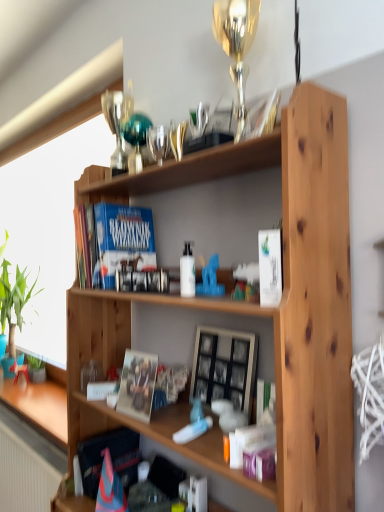
Question: Considering the relative positions of green leafy plant at left, which is the 2th houseplant in front-to-back order, and white glossy bottle at center in the image provided, is green leafy plant at left, which is the 2th houseplant in front-to-back order, to the left of white glossy bottle at center from the viewer's perspective?

Choices:
 (A) no
 (B) yes

Answer: (B)

Question: Is green leafy plant at left, which is the first houseplant in top-to-bottom order, taller than white glossy bottle at center?

Choices:
 (A) no
 (B) yes

Answer: (B)

Question: Is green leafy plant at left, arranged as the 1th houseplant when viewed from the back, facing away from white glossy bottle at center?

Choices:
 (A) no
 (B) yes

Answer: (A)

Question: Is green leafy plant at left, which is the first houseplant in top-to-bottom order, touching white glossy bottle at center?

Choices:
 (A) no
 (B) yes

Answer: (A)

Question: Considering the relative sizes of green leafy plant at left, which appears as the second houseplant when ordered from the bottom, and white glossy bottle at center in the image provided, is green leafy plant at left, which appears as the second houseplant when ordered from the bottom, bigger than white glossy bottle at center?

Choices:
 (A) no
 (B) yes

Answer: (B)

Question: Is green leafy plant at left, which appears as the second houseplant when ordered from the bottom, in front of white glossy bottle at center?

Choices:
 (A) yes
 (B) no

Answer: (B)

Question: Is blue matte book at upper left, which is counted as the second paperback book, starting from the front, positioned beyond the bounds of green leafy plant at left, positioned as the first houseplant in left-to-right order?

Choices:
 (A) no
 (B) yes

Answer: (B)

Question: Is blue matte book at upper left, which appears as the second paperback book when viewed from the right, facing away from green leafy plant at left, which is the first houseplant in top-to-bottom order?

Choices:
 (A) yes
 (B) no

Answer: (B)

Question: From the image's perspective, is blue matte book at upper left, which appears as the second paperback book when viewed from the right, beneath green leafy plant at left, arranged as the 1th houseplant when viewed from the back?

Choices:
 (A) yes
 (B) no

Answer: (B)

Question: From a real-world perspective, is blue matte book at upper left, which is counted as the second paperback book, starting from the front, under green leafy plant at left, arranged as the 1th houseplant when viewed from the back?

Choices:
 (A) yes
 (B) no

Answer: (B)

Question: Does blue matte book at upper left, the first paperback book in the left-to-right sequence, lie behind green leafy plant at left, which is the 2th houseplant in front-to-back order?

Choices:
 (A) no
 (B) yes

Answer: (A)

Question: From the image's perspective, is blue matte book at upper left, marked as the 1th paperback book in a back-to-front arrangement, above green leafy plant at left, arranged as the 1th houseplant when viewed from the back?

Choices:
 (A) no
 (B) yes

Answer: (B)

Question: Is the position of green leafy plant at left, which appears as the second houseplant when ordered from the bottom, more distant than that of matte white coffee cup at lower left?

Choices:
 (A) yes
 (B) no

Answer: (A)